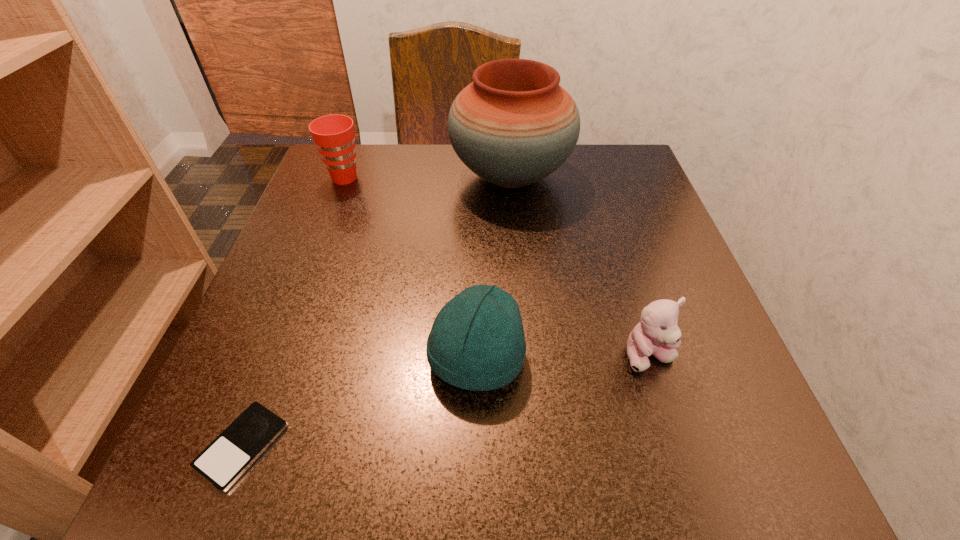
Identify the location of unoccupied area between the beanie and the tallest object. Image resolution: width=960 pixels, height=540 pixels. (493, 267).

Identify the location of free space between the rightmost object and the beanie. This screenshot has width=960, height=540. (563, 357).

Locate an element on the screen. The image size is (960, 540). free point between the teddy bear and the pottery is located at coordinates (580, 266).

Identify the location of unoccupied position between the beanie and the iPod. (359, 402).

I want to click on unoccupied position between the cup and the shortest object, so click(x=294, y=312).

Identify the location of free space between the tallest object and the rightmost object. This screenshot has height=540, width=960. (580, 266).

Locate an element on the screen. This screenshot has height=540, width=960. object that is the second closest to the beanie is located at coordinates (227, 457).

Locate an element on the screen. the third closest object to the cup is located at coordinates (227, 457).

At what (x,y) coordinates should I click in order to perform the action: click on vacant space that satisfies the following two spatial constraints: 1. on the back side of the cup; 2. on the left side of the iPod. Please return your answer as a coordinate pair (x, y). The height and width of the screenshot is (540, 960). Looking at the image, I should click on (344, 178).